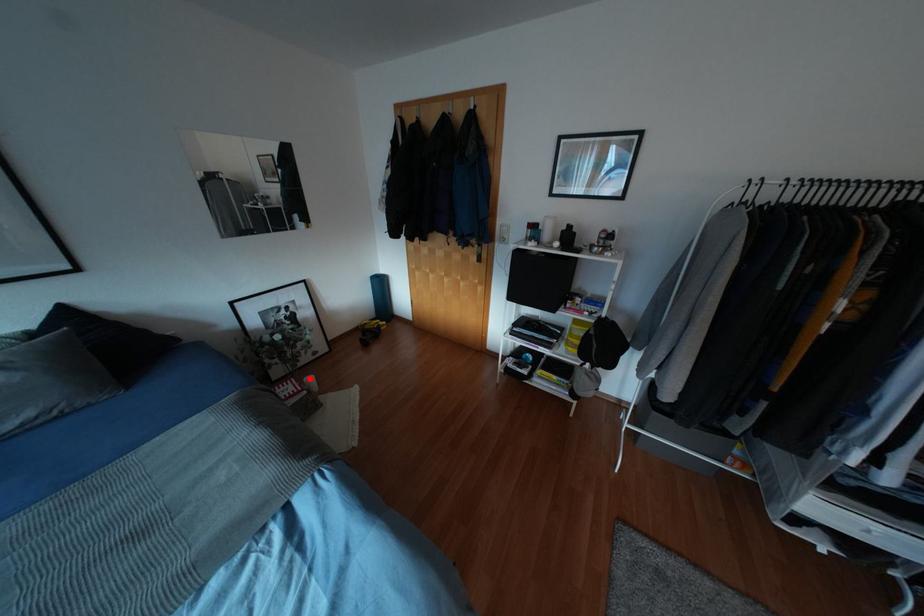
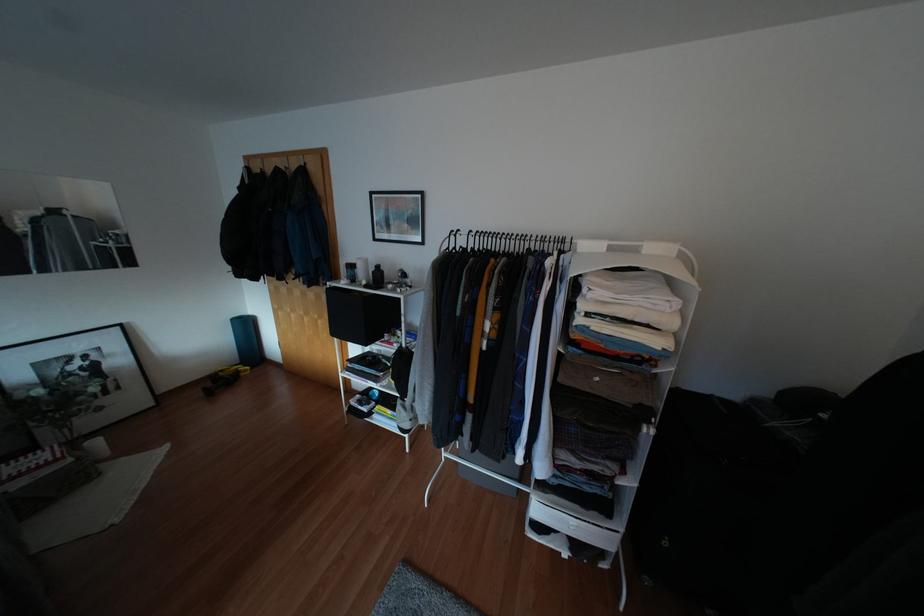
Where in the second image is the point corresponding to the highlighted location from the first image?

(94, 442)